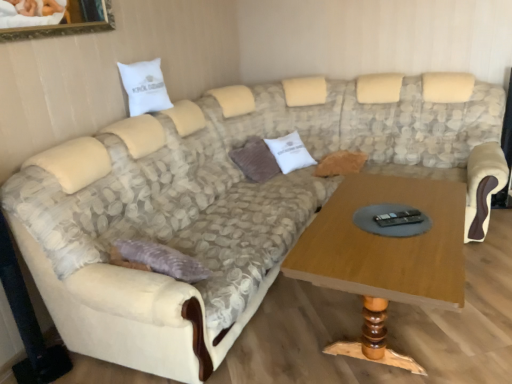
Question: Visually, is white cotton pillow at center, acting as the third pillow starting from the left, positioned to the left or to the right of brown corduroy pillow at center, the second pillow viewed from the left?

Choices:
 (A) left
 (B) right

Answer: (B)

Question: In the image, is white cotton pillow at center, which ranks as the first pillow in right-to-left order, positioned in front of or behind brown corduroy pillow at center, the second pillow viewed from the left?

Choices:
 (A) front
 (B) behind

Answer: (B)

Question: Based on their relative distances, which object is farther from the white cotton pillow at center, acting as the third pillow starting from the left?

Choices:
 (A) white cotton pillow at upper left, the 1th pillow in the left-to-right sequence
 (B) wooden coffee table at center
 (C) brown corduroy pillow at center, which is the 2th pillow from right to left

Answer: (B)

Question: Based on their relative distances, which object is nearer to the white cotton pillow at upper left, marked as the third pillow in a right-to-left arrangement?

Choices:
 (A) white cotton pillow at center, acting as the third pillow starting from the left
 (B) wooden coffee table at center
 (C) brown corduroy pillow at center, the second pillow viewed from the left

Answer: (C)